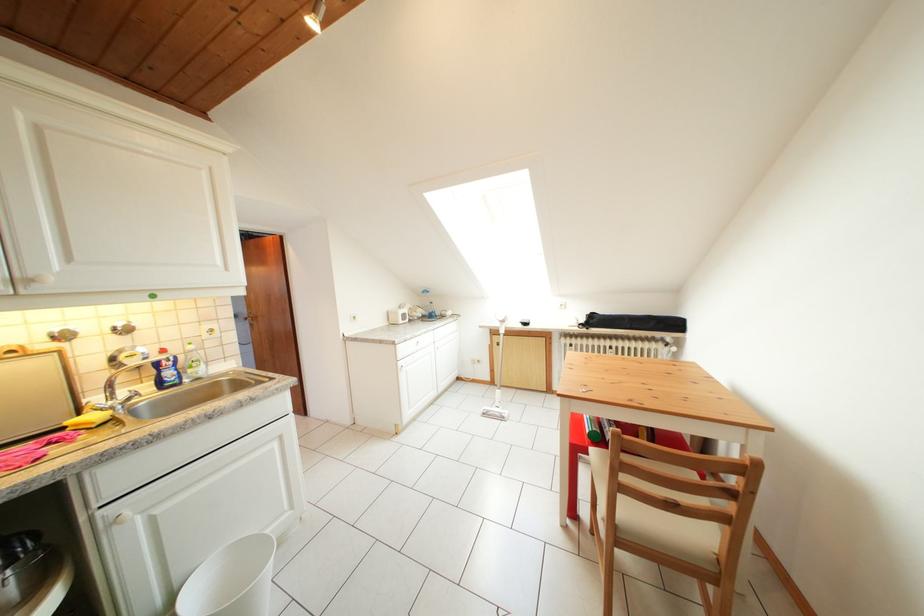
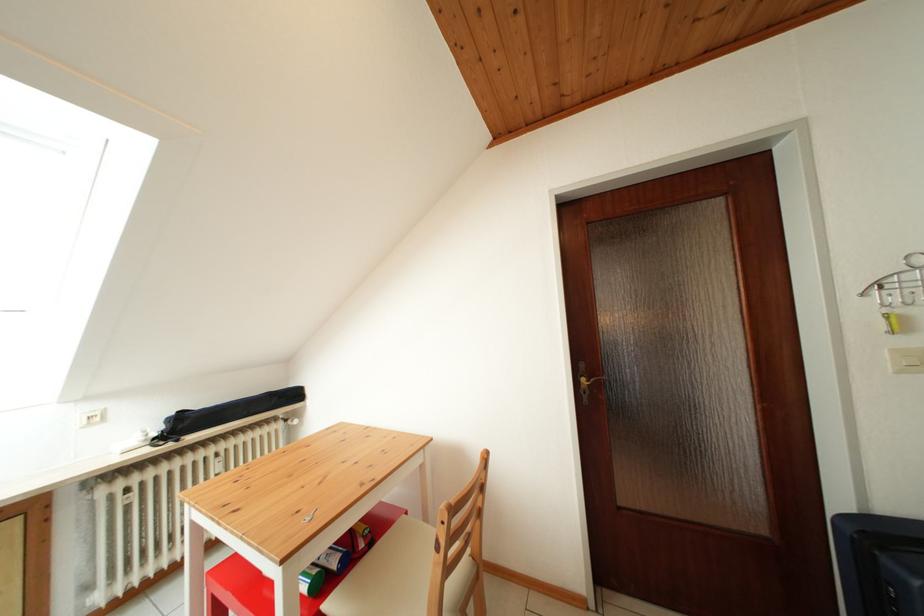
Question: The images are taken continuously from a first-person perspective. In which direction is your viewpoint rotating?

Choices:
 (A) Left
 (B) Right
 (C) Up
 (D) Down

Answer: (B)